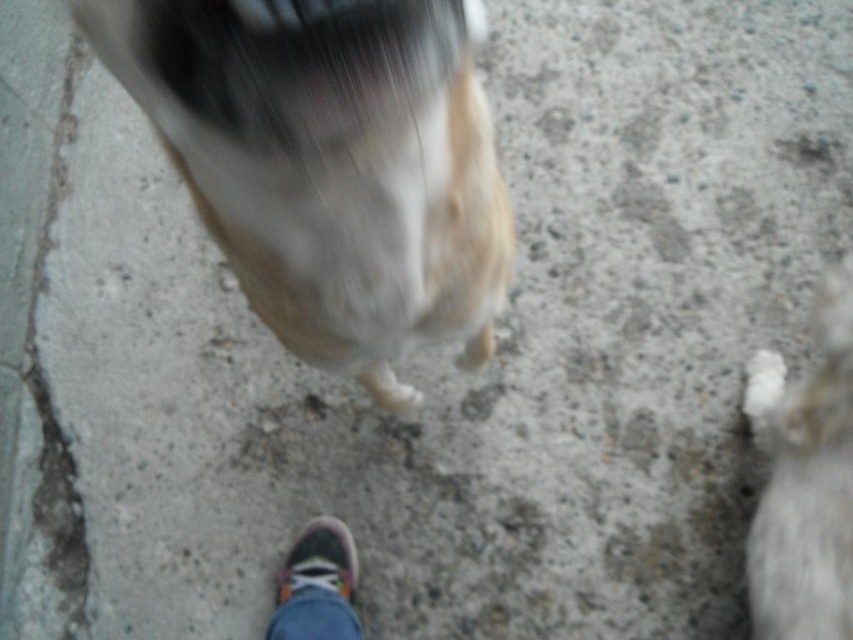
This screenshot has height=640, width=853. In order to click on fluffy white dog at center in this screenshot , I will do `click(331, 164)`.

Who is shorter, fluffy white dog at center or white fluffy dog at lower right?

fluffy white dog at center is shorter.

Between point (146, 96) and point (813, 321), which one is positioned in front?

Point (146, 96) is in front.

At what (x,y) coordinates should I click in order to perform the action: click on fluffy white dog at center. Please return your answer as a coordinate pair (x, y). The width and height of the screenshot is (853, 640). Looking at the image, I should click on (331, 164).

Is fluffy white dog at center to the right of multicolored canvas shoe at lower center from the viewer's perspective?

Yes, fluffy white dog at center is to the right of multicolored canvas shoe at lower center.

Between point (334, 102) and point (341, 556), which one is positioned behind?

The point (341, 556) is behind.

Locate an element on the screen. This screenshot has height=640, width=853. fluffy white dog at center is located at coordinates (331, 164).

How far apart are white fluffy dog at lower right and multicolored canvas shoe at lower center?

white fluffy dog at lower right and multicolored canvas shoe at lower center are 29.21 inches apart from each other.

Who is shorter, white fluffy dog at lower right or multicolored canvas shoe at lower center?

multicolored canvas shoe at lower center is shorter.

Find the location of `white fluffy dog at lower right`. white fluffy dog at lower right is located at coordinates (804, 481).